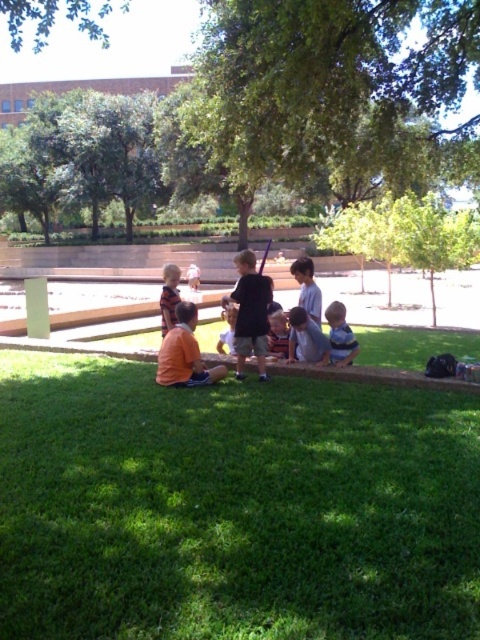
Between blue striped shirt at lower right and light blue shirt at center, which one appears on the right side from the viewer's perspective?

Positioned to the right is light blue shirt at center.

Between point (331, 336) and point (311, 284), which one is positioned behind?

Point (311, 284)

Where is `blue striped shirt at lower right`? The image size is (480, 640). blue striped shirt at lower right is located at coordinates (339, 336).

Can you confirm if green grass at lower center is wider than black cotton shirt at center?

Indeed, green grass at lower center has a greater width compared to black cotton shirt at center.

Does point (61, 436) come farther from viewer compared to point (264, 300)?

That is False.

Identify the location of green grass at lower center. The image size is (480, 640). (232, 506).

Who is more forward, (179, 353) or (331, 349)?

Positioned in front is point (179, 353).

Can you confirm if orange cotton shirt at lower left is taller than blue striped shirt at lower right?

Indeed, orange cotton shirt at lower left has a greater height compared to blue striped shirt at lower right.

Is point (200, 356) behind point (330, 346)?

No, it is not.

This screenshot has width=480, height=640. I want to click on orange cotton shirt at lower left, so click(x=184, y=353).